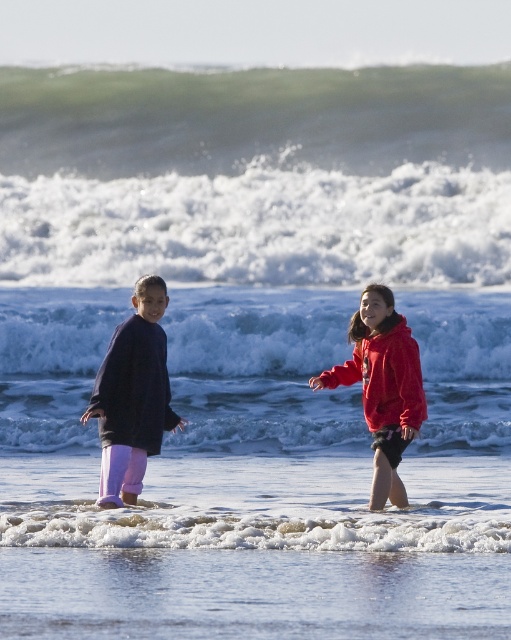
Who is taller, red fleece jacket at center or matte black hand at center?

Standing taller between the two is red fleece jacket at center.

What do you see at coordinates (384, 376) in the screenshot? I see `red fleece jacket at center` at bounding box center [384, 376].

Is point (385, 403) behind point (180, 420)?

That is False.

Where is `red fleece jacket at center`? The image size is (511, 640). red fleece jacket at center is located at coordinates (384, 376).

What do you see at coordinates (260, 227) in the screenshot? The image size is (511, 640). I see `white foamy wave at upper center` at bounding box center [260, 227].

Who is positioned more to the left, white foamy wave at upper center or matte black hand at center?

matte black hand at center is more to the left.

Describe the element at coordinates (260, 227) in the screenshot. I see `white foamy wave at upper center` at that location.

What are the coordinates of `white foamy wave at upper center` in the screenshot? It's located at (260, 227).

In the scene shown: Who is taller, green frothy wave at upper center or smooth red hand at center?

green frothy wave at upper center is taller.

Does green frothy wave at upper center have a lesser height compared to smooth red hand at center?

In fact, green frothy wave at upper center may be taller than smooth red hand at center.

Does point (66, 70) come closer to viewer compared to point (313, 380)?

No, (66, 70) is further to viewer.

Locate an element on the screen. The image size is (511, 640). green frothy wave at upper center is located at coordinates (250, 116).